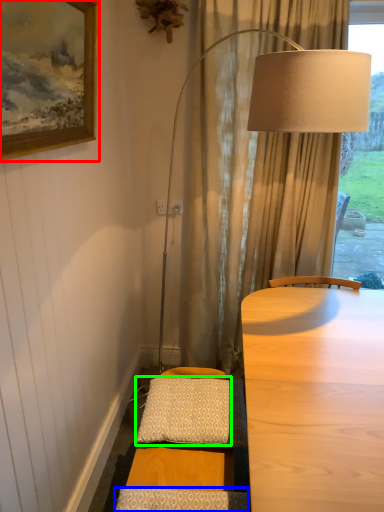
Question: Which object is positioned closest to picture frame (highlighted by a red box)? Select from pillow (highlighted by a blue box) and pillow (highlighted by a green box).

Choices:
 (A) pillow
 (B) pillow

Answer: (B)